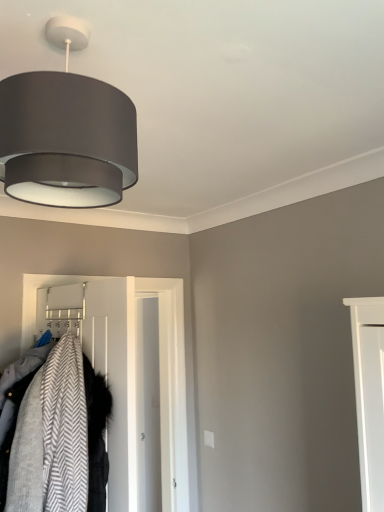
Question: In terms of size, does gray herringbone fabric coat at left appear bigger or smaller than matte gray fabric lampshade at upper left?

Choices:
 (A) big
 (B) small

Answer: (A)

Question: Based on their positions, is gray herringbone fabric coat at left located to the left or right of matte gray fabric lampshade at upper left?

Choices:
 (A) left
 (B) right

Answer: (A)

Question: Which is nearer to the matte gray fabric lampshade at upper left?

Choices:
 (A) white plastic hanger at center
 (B) gray herringbone fabric coat at left
 (C) white smooth door at center

Answer: (B)

Question: Which object is the farthest from the white smooth door at center?

Choices:
 (A) gray herringbone fabric coat at left
 (B) white plastic hanger at center
 (C) matte gray fabric lampshade at upper left

Answer: (C)